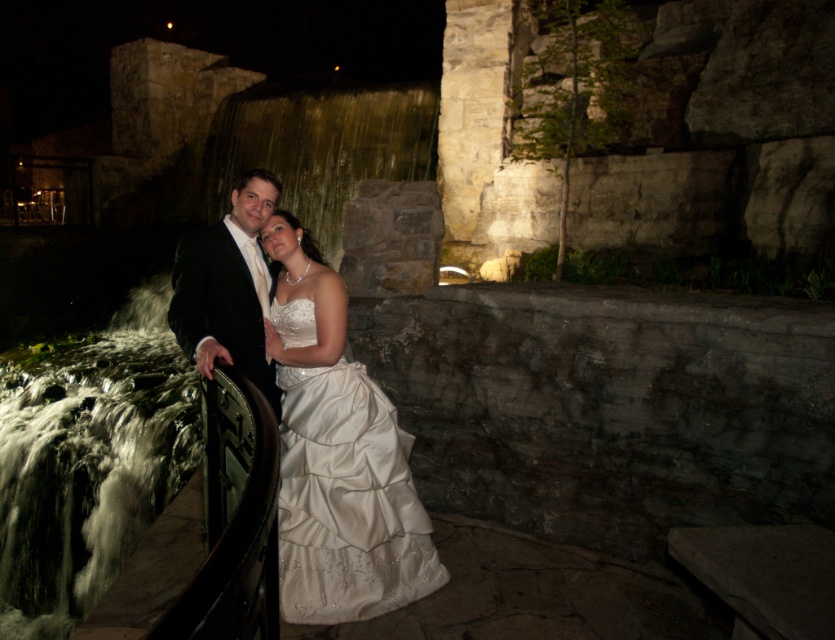
Question: Among these points, which one is nearest to the camera?

Choices:
 (A) (180, 330)
 (B) (257, 301)
 (C) (322, 529)

Answer: (C)

Question: Which of these objects is positioned farthest from the satin white dress at center?

Choices:
 (A) shiny black suit at center
 (B) satin/sheen wedding dress at center

Answer: (A)

Question: Is satin white dress at center below satin/sheen wedding dress at center?

Choices:
 (A) yes
 (B) no

Answer: (B)

Question: Which point appears farthest from the camera in this image?

Choices:
 (A) (362, 561)
 (B) (236, 216)
 (C) (372, 561)

Answer: (B)

Question: Does satin/sheen wedding dress at center lie in front of shiny black suit at center?

Choices:
 (A) yes
 (B) no

Answer: (B)

Question: In this image, where is satin white dress at center located relative to satin/sheen wedding dress at center?

Choices:
 (A) above
 (B) below

Answer: (A)